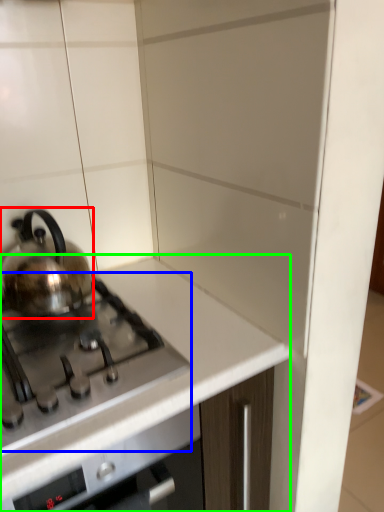
Question: Which is farther away from kettle (highlighted by a red box)? gas stove (highlighted by a blue box) or countertop (highlighted by a green box)?

Choices:
 (A) gas stove
 (B) countertop

Answer: (B)